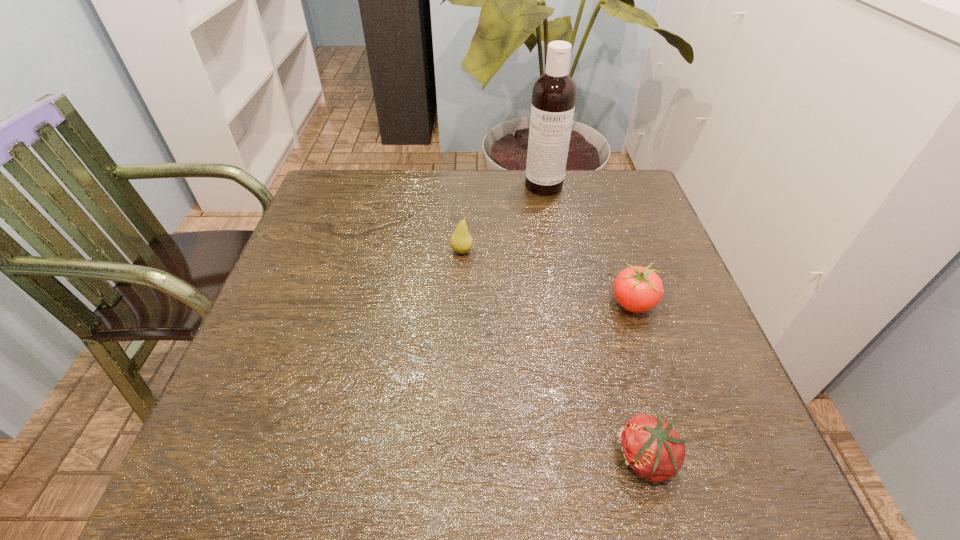
Identify the location of the tallest object. (554, 93).

The width and height of the screenshot is (960, 540). I want to click on the farthest object, so click(554, 93).

Locate an element on the screen. This screenshot has height=540, width=960. pear is located at coordinates (461, 241).

You are a GUI agent. You are given a task and a screenshot of the screen. Output one action in this format:
    pyautogui.click(x=<x>, y=<y>)
    Task: Click on the leftmost object
    
    Given the screenshot: What is the action you would take?
    pyautogui.click(x=461, y=241)

Locate an element on the screen. The height and width of the screenshot is (540, 960). the taller tomato is located at coordinates (637, 289).

You are a GUI agent. You are given a task and a screenshot of the screen. Output one action in this format:
    pyautogui.click(x=<x>, y=<y>)
    Task: Click on the second nearest object
    Image resolution: width=960 pixels, height=540 pixels.
    Given the screenshot: What is the action you would take?
    pyautogui.click(x=637, y=289)

Locate an element on the screen. the nearest object is located at coordinates (651, 448).

This screenshot has width=960, height=540. Identify the location of the shorter tomato. (651, 448).

Where is `vacant area located 0.160m on the label side of the farthest object`? This screenshot has height=540, width=960. vacant area located 0.160m on the label side of the farthest object is located at coordinates (552, 233).

Find the location of `vacant position located 0.080m on the front of the pear`. vacant position located 0.080m on the front of the pear is located at coordinates (461, 282).